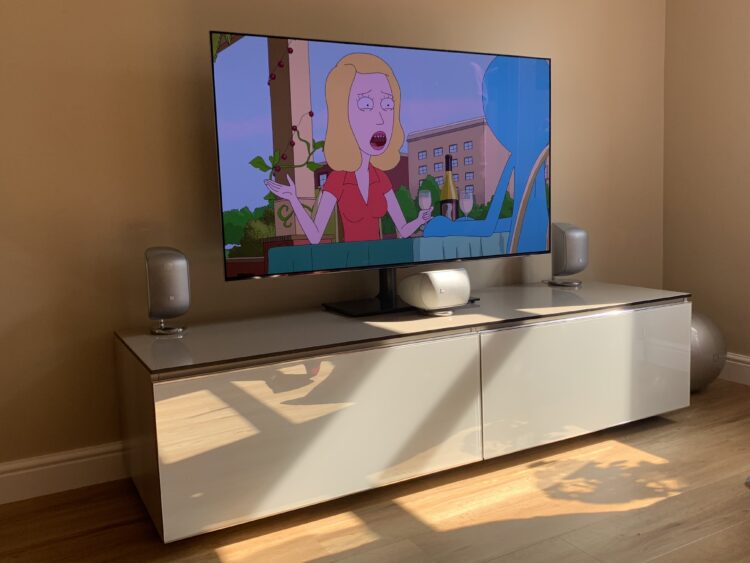
The width and height of the screenshot is (750, 563). I want to click on television unit, so click(x=294, y=342).